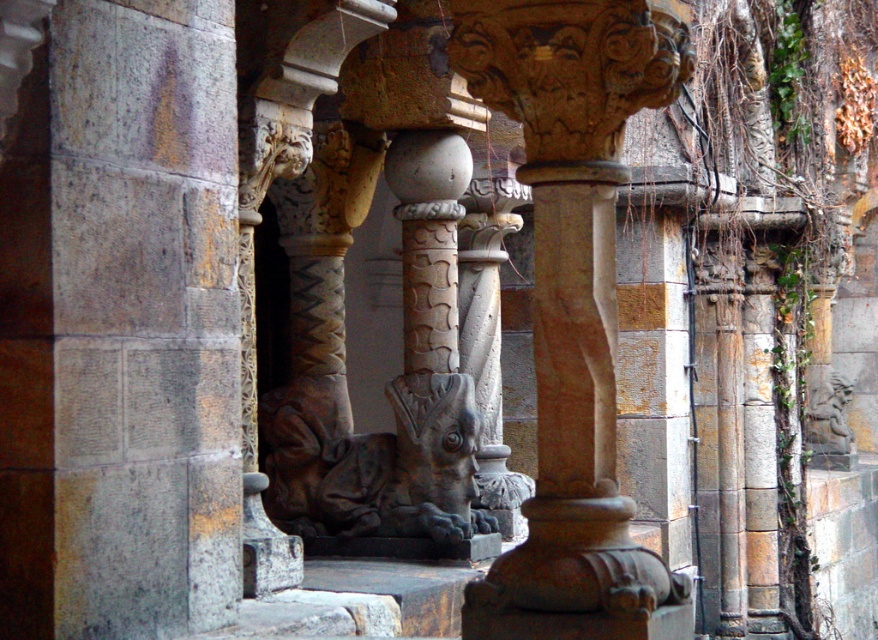
What do you see at coordinates (573, 305) in the screenshot? The width and height of the screenshot is (878, 640). I see `smooth stone column at center` at bounding box center [573, 305].

I want to click on smooth stone column at center, so click(x=573, y=305).

I want to click on smooth stone column at center, so pos(573,305).

Who is lower down, gray stone pillar at left or dark gray stone gargoyle at center?

Positioned lower is dark gray stone gargoyle at center.

Can you confirm if gray stone pillar at left is positioned to the left of dark gray stone gargoyle at center?

Correct, you'll find gray stone pillar at left to the left of dark gray stone gargoyle at center.

Between point (184, 576) and point (469, 484), which one is positioned behind?

The point (469, 484) is behind.

At what (x,y) coordinates should I click in order to perform the action: click on gray stone pillar at left. Please return your answer as a coordinate pair (x, y). The height and width of the screenshot is (640, 878). Looking at the image, I should click on (144, 317).

Which is below, gray stone pillar at left or smooth stone column at center?

gray stone pillar at left

Does point (171, 266) lie behind point (567, 490)?

Yes, it is.

Locate an element on the screen. The height and width of the screenshot is (640, 878). gray stone pillar at left is located at coordinates (144, 317).